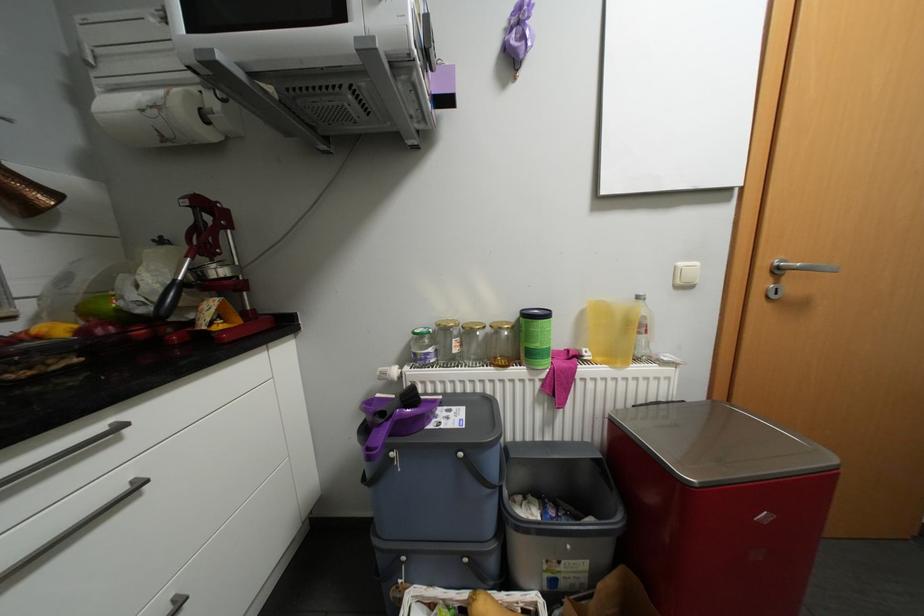
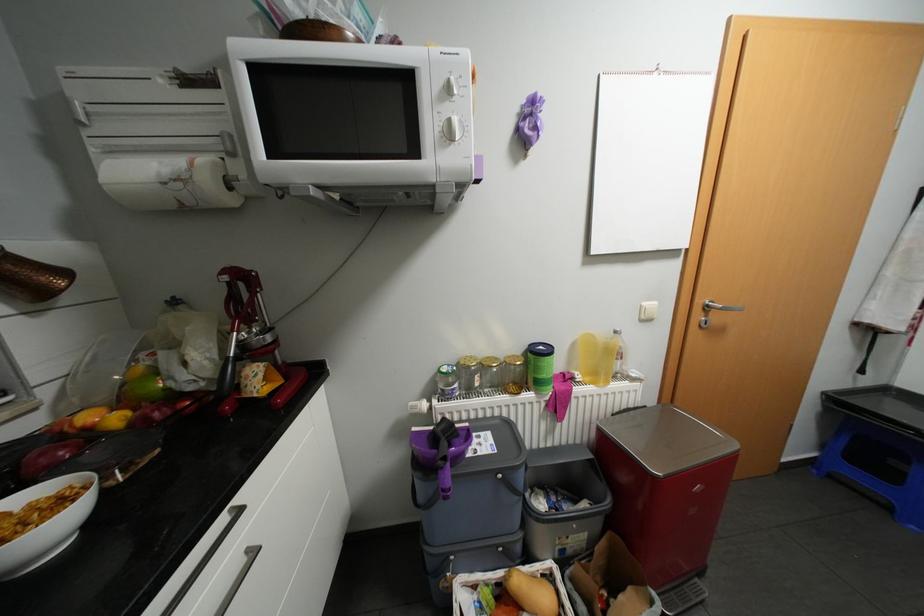
Locate, in the second image, the point that corresponds to the point at 489,322 in the first image.

(504, 358)